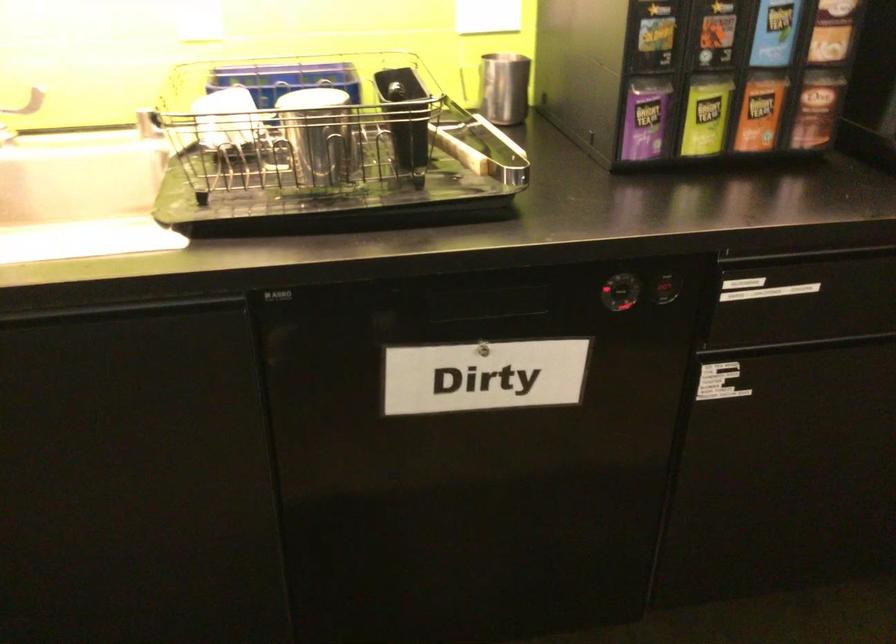
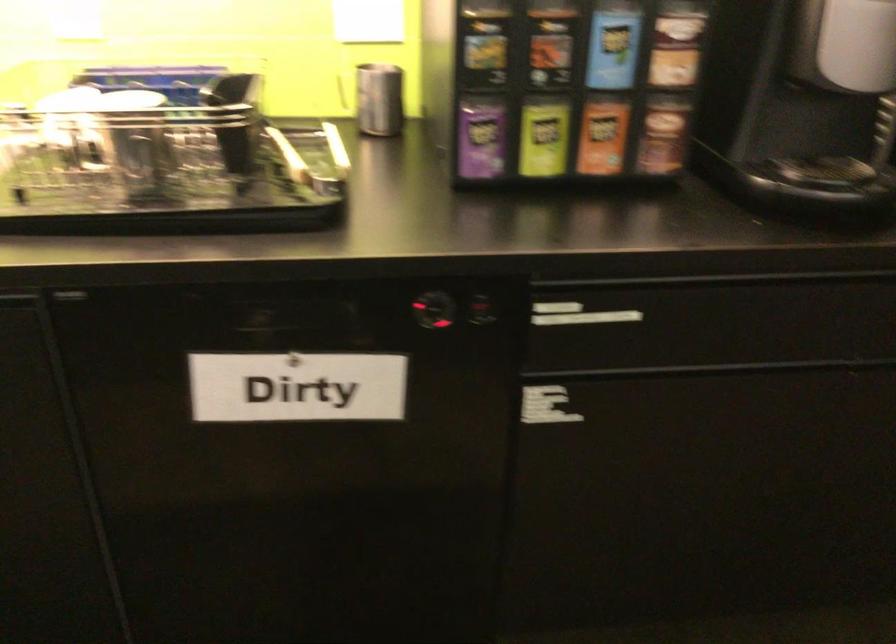
The point at (705, 116) is marked in the first image. Where is the corresponding point in the second image?

(543, 138)